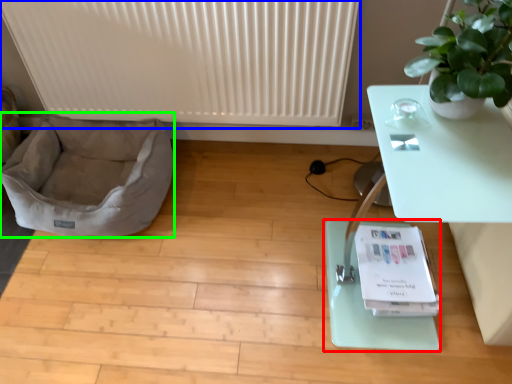
Question: Which object is positioned farthest from yoga mat (highlighted by a red box)? Select from radiator (highlighted by a blue box) and dog bed (highlighted by a green box).

Choices:
 (A) radiator
 (B) dog bed

Answer: (B)